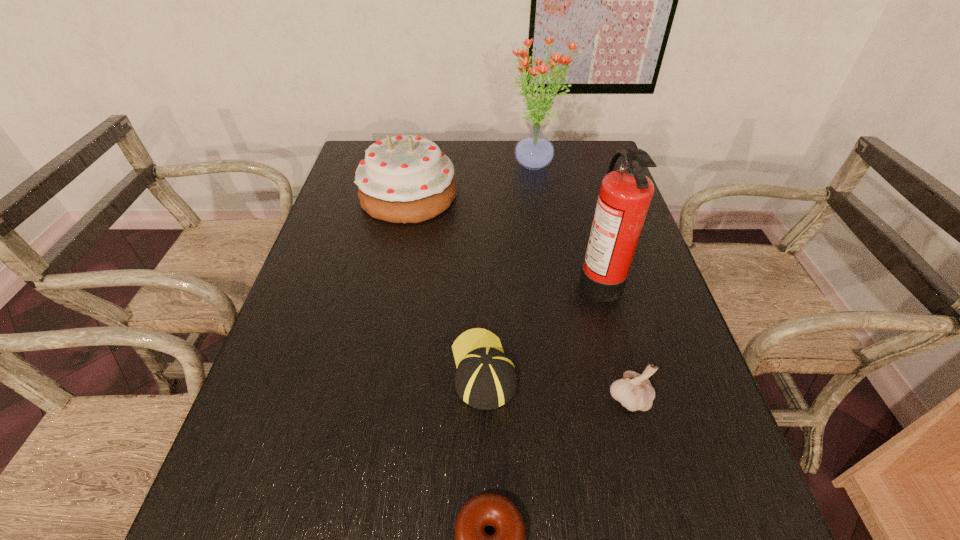
Locate an element on the screen. garlic located at the right edge is located at coordinates (635, 392).

Identify the location of object located in the far left corner section of the desktop. The image size is (960, 540). (404, 179).

Where is `object that is at the far right corner`? object that is at the far right corner is located at coordinates (534, 151).

The height and width of the screenshot is (540, 960). Find the location of `blank space at the far edge of the desktop`. blank space at the far edge of the desktop is located at coordinates (461, 161).

At what (x,y) coordinates should I click in order to perform the action: click on vacant region at the left edge of the desktop. Please return your answer as a coordinate pair (x, y). This screenshot has height=540, width=960. Looking at the image, I should click on (357, 262).

Where is `vacant space at the right edge of the desktop`? The height and width of the screenshot is (540, 960). vacant space at the right edge of the desktop is located at coordinates tap(647, 441).

I want to click on free space between the cake and the garlic, so click(x=518, y=297).

The height and width of the screenshot is (540, 960). Identify the location of unoccupied position between the fourth nearest object and the flower arrangement. (567, 222).

Where is `vacant point located between the fire extinguisher and the third shortest object`? Image resolution: width=960 pixels, height=540 pixels. vacant point located between the fire extinguisher and the third shortest object is located at coordinates (613, 338).

Identify the location of vacant space in between the second shortest object and the leftmost object. This screenshot has height=540, width=960. (445, 282).